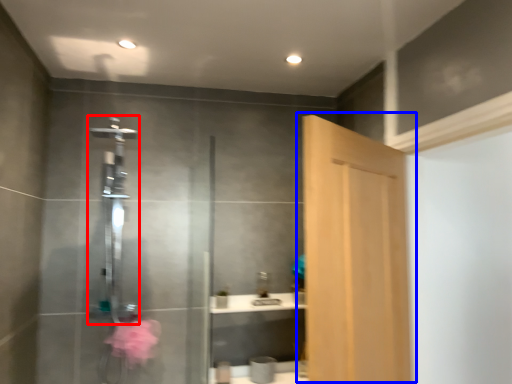
Question: Which object appears farthest to the camera in this image, shower (highlighted by a red box) or door (highlighted by a blue box)?

Choices:
 (A) shower
 (B) door

Answer: (A)